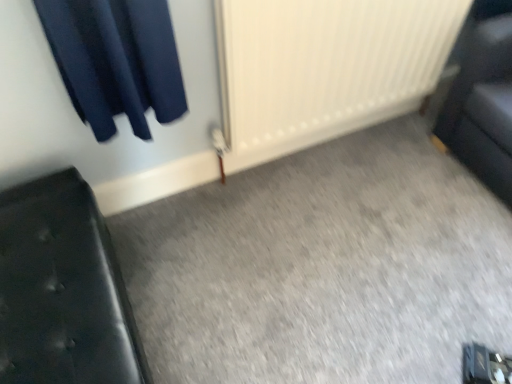
Question: Based on their positions, is white textured radiator at center located to the left or right of black leather couch at left?

Choices:
 (A) left
 (B) right

Answer: (B)

Question: Considering the positions of white textured radiator at center and black leather couch at left in the image, is white textured radiator at center wider or thinner than black leather couch at left?

Choices:
 (A) thin
 (B) wide

Answer: (A)

Question: Is white textured radiator at center taller or shorter than black leather couch at left?

Choices:
 (A) short
 (B) tall

Answer: (B)

Question: From the image's perspective, is black leather couch at left above or below white textured radiator at center?

Choices:
 (A) above
 (B) below

Answer: (B)

Question: Considering the positions of black leather couch at left and white textured radiator at center in the image, is black leather couch at left taller or shorter than white textured radiator at center?

Choices:
 (A) short
 (B) tall

Answer: (A)

Question: Considering the positions of black leather couch at left and white textured radiator at center in the image, is black leather couch at left bigger or smaller than white textured radiator at center?

Choices:
 (A) small
 (B) big

Answer: (A)

Question: Considering the positions of point (31, 213) and point (241, 96), is point (31, 213) closer or farther from the camera than point (241, 96)?

Choices:
 (A) farther
 (B) closer

Answer: (B)